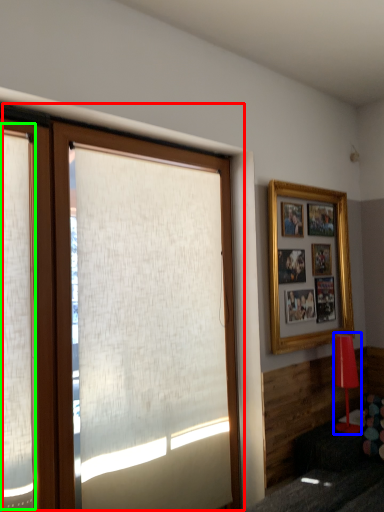
Question: Considering the real-world distances, which object is farthest from window (highlighted by a red box)? lamp (highlighted by a blue box) or shutter (highlighted by a green box)?

Choices:
 (A) lamp
 (B) shutter

Answer: (A)